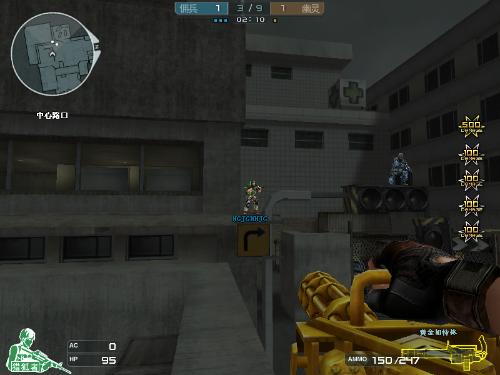
Locate an element on the screen. The height and width of the screenshot is (375, 500). map is located at coordinates (69, 72).